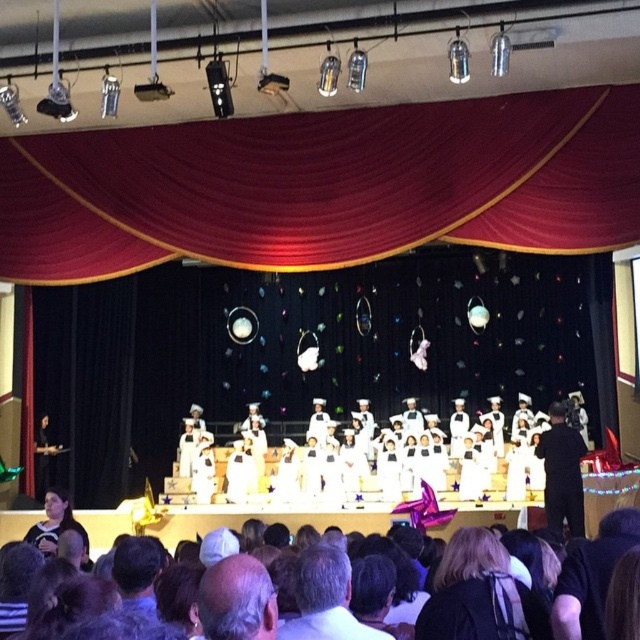
You are a photographer at the graduation ceremony. You want to take a photo of the dark brown hair at lower center without the velvet red curtain at upper center appearing in the background. Is this possible?

The dark brown hair at lower center is behind the velvet red curtain at upper center, so it is not possible to take a photo of the dark brown hair at lower center without the velvet red curtain at upper center appearing in the background.

You are a photographer taking a picture of the graduates. You notice the white matte uniform at center and the dark brown hair at lower center. Which one should you adjust your camera focus to ensure both are in frame without cropping?

The white matte uniform at center is taller than dark brown hair at lower center, so you should focus on the white matte uniform at center to ensure both are within the frame without cropping.